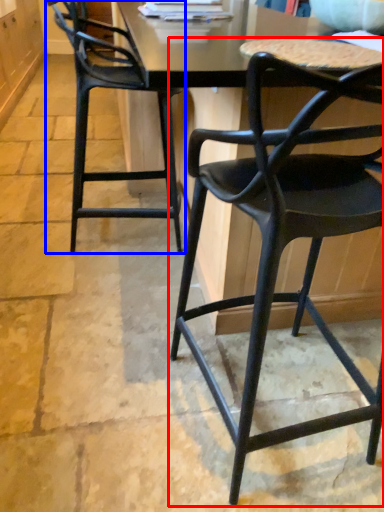
Question: Which object is closer to the camera taking this photo, chair (highlighted by a red box) or chair (highlighted by a blue box)?

Choices:
 (A) chair
 (B) chair

Answer: (A)